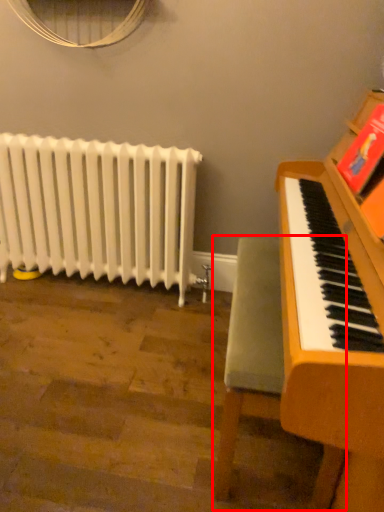
Question: Where is armchair (annotated by the red box) located in relation to radiator in the image?

Choices:
 (A) right
 (B) left

Answer: (A)